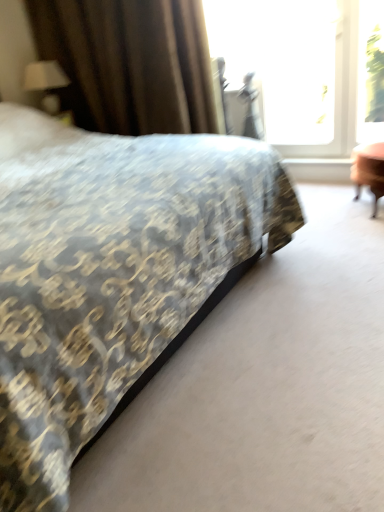
Question: Does patterned fabric bed at center have a larger size compared to transparent glass window at upper right?

Choices:
 (A) no
 (B) yes

Answer: (B)

Question: Is transparent glass window at upper right located within patterned fabric bed at center?

Choices:
 (A) no
 (B) yes

Answer: (A)

Question: Can you confirm if patterned fabric bed at center is wider than transparent glass window at upper right?

Choices:
 (A) no
 (B) yes

Answer: (B)

Question: Is patterned fabric bed at center oriented towards transparent glass window at upper right?

Choices:
 (A) no
 (B) yes

Answer: (A)

Question: From the image's perspective, is patterned fabric bed at center on transparent glass window at upper right?

Choices:
 (A) no
 (B) yes

Answer: (A)

Question: Is patterned fabric bed at center further to camera compared to transparent glass window at upper right?

Choices:
 (A) no
 (B) yes

Answer: (A)

Question: Is transparent glass window screen at upper right positioned behind brown textured curtain at upper left?

Choices:
 (A) no
 (B) yes

Answer: (B)

Question: Is transparent glass window screen at upper right wider than brown textured curtain at upper left?

Choices:
 (A) no
 (B) yes

Answer: (A)

Question: From a real-world perspective, is transparent glass window screen at upper right physically above brown textured curtain at upper left?

Choices:
 (A) no
 (B) yes

Answer: (A)

Question: Is transparent glass window screen at upper right at the right side of brown textured curtain at upper left?

Choices:
 (A) no
 (B) yes

Answer: (B)

Question: From the image's perspective, is transparent glass window screen at upper right under brown textured curtain at upper left?

Choices:
 (A) yes
 (B) no

Answer: (A)

Question: Is transparent glass window screen at upper right aimed at brown textured curtain at upper left?

Choices:
 (A) no
 (B) yes

Answer: (A)

Question: From the image's perspective, is transparent glass window screen at upper right above patterned fabric bed at center?

Choices:
 (A) yes
 (B) no

Answer: (A)